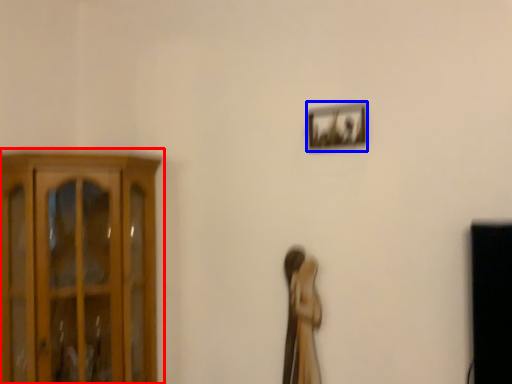
Question: Which point is further to the camera, cupboard (highlighted by a red box) or picture frame (highlighted by a blue box)?

Choices:
 (A) cupboard
 (B) picture frame

Answer: (B)